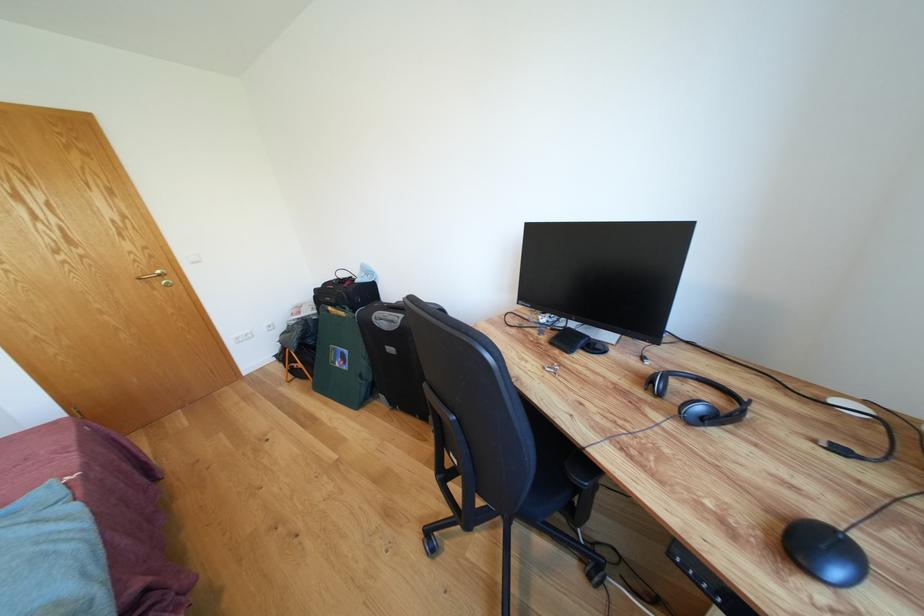
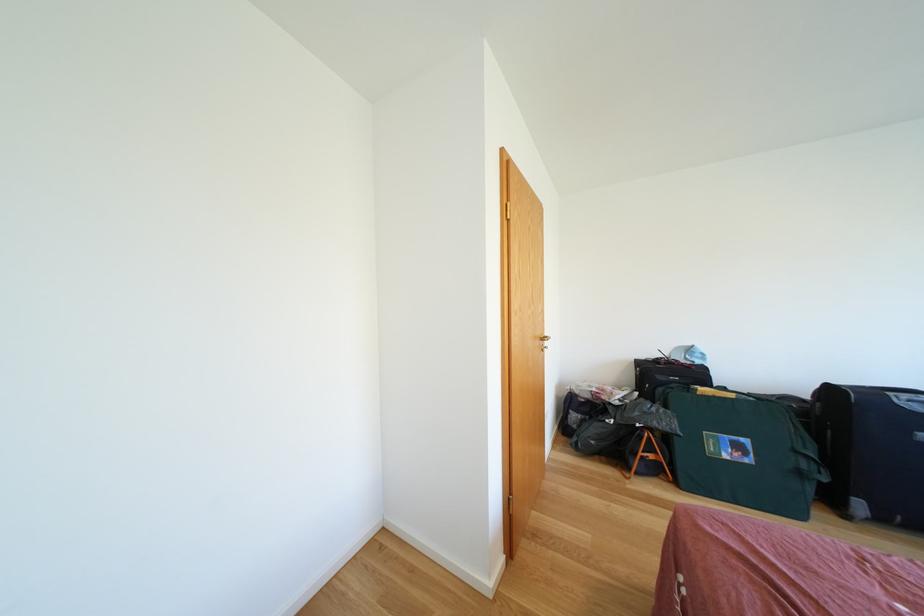
Question: Which direction would the cameraman need to move to produce the second image? Reply with the corresponding letter.

Choices:
 (A) Left
 (B) Right
 (C) Forward
 (D) Backward

Answer: (A)